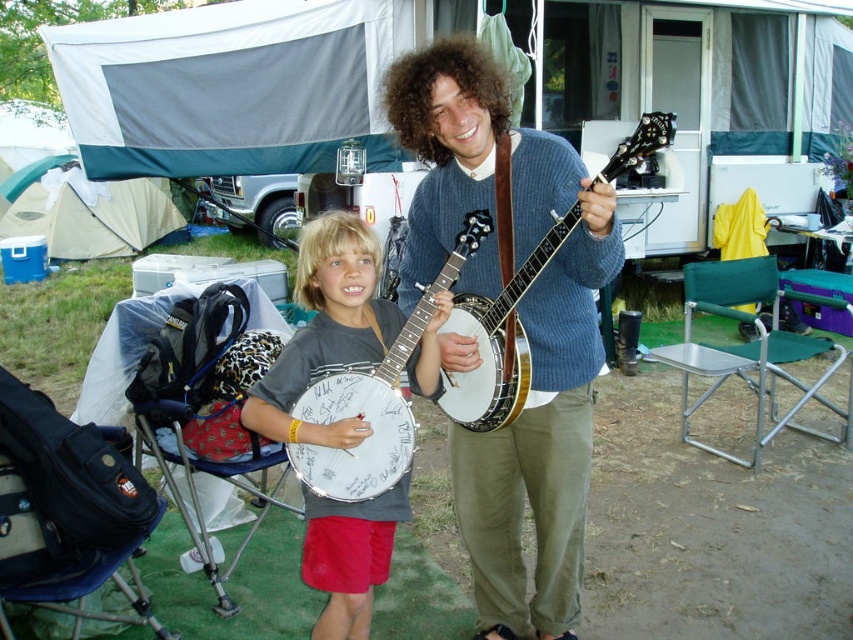
You are a photographer setting up for a group photo at the campsite. You need to position the blue knitted sweater at center and the green fabric folding chair at lower right so that both are clearly visible in the frame. Based on their current positions, will you need to adjust their positions to ensure both are visible?

The blue knitted sweater at center is in front of the green fabric folding chair at lower right, so the chair may be partially obscured. To ensure both are clearly visible, you should move the sweater or the chair so they are not overlapping in the frame.

You are standing in the campsite scene and want to place a small flag at the point closer to you between point A at point (550, 632) and point B at point (486, 381). Which point should you choose?

You should choose point A at point (550, 632) because it is closer to you than point B at point (486, 381).

You are a photographer trying to capture a group photo of the blue knitted sweater at center and the white wood banjo at center. Based on their sizes, which object should you focus on first to ensure proper framing?

The blue knitted sweater at center is much taller than the white wood banjo at center, so you should focus on the blue knitted sweater at center first to ensure it fits properly in the frame.